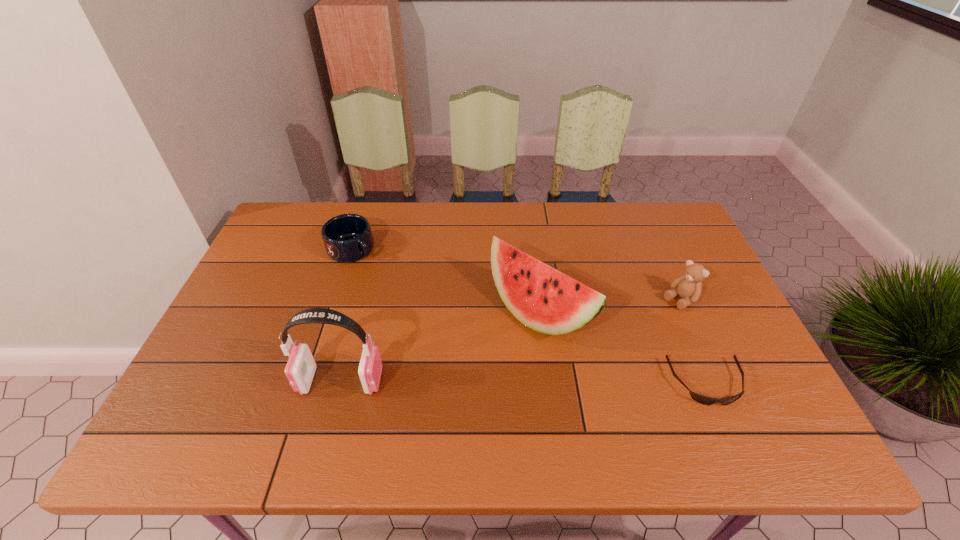
This screenshot has height=540, width=960. I want to click on free space that satisfies the following two spatial constraints: 1. on the front side of the farthest object; 2. on the outer surface of the tallest object, so click(x=308, y=381).